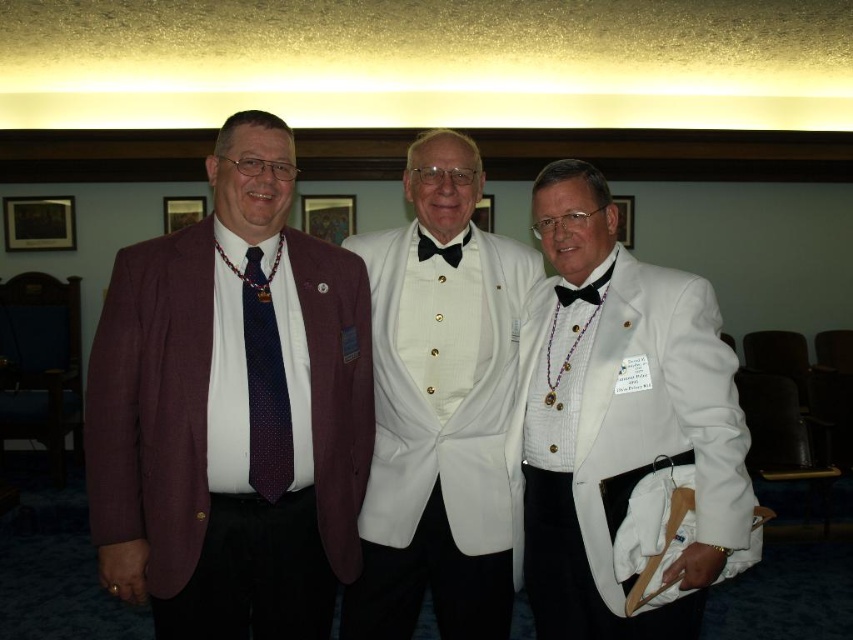
You are a photographer at the event and need to ensure that the black satin bow tie at center is visible in the photo. Since the white satin tuxedo at center is covering part of it, where should you position the camera to capture the bow tie without obstruction?

The white satin tuxedo at center is below the black satin bow tie at center, so positioning the camera slightly above the subject will ensure the bow tie is visible and not blocked by the tuxedo.

You are a photographer at the event and need to ensure that both the white satin bow tie at center and the black satin bow tie at center are in focus. The camera you are using has a depth of field that can cover 25 inches. Will both bow ties be in focus?

The white satin bow tie at center and black satin bow tie at center are 25.74 inches apart. Since the depth of field can only cover 25 inches, the distance between them exceeds the camera setting, so both bow ties cannot be in focus simultaneously.

From the picture: You are a photographer at this event and need to ensure that the matte maroon blazer at left and the white satin bow tie at center are clearly visible in the photo. Given that the camera has a minimum focus distance of 25 inches, will you be able to capture both items in focus without moving closer?

The matte maroon blazer at left is 27.06 inches from the white satin bow tie at center. Since the minimum focus distance is 25 inches, the distance between them is sufficient for both items to be in focus as long as the camera is positioned appropriately.